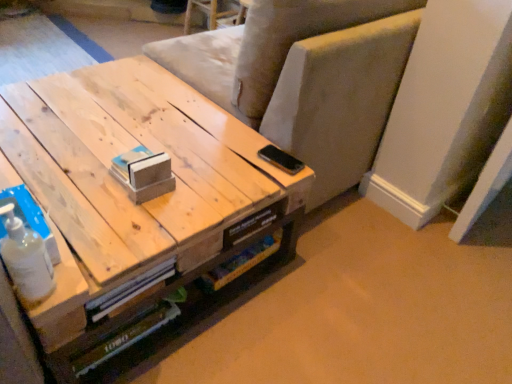
Where is `vacant space behind white matte bottle at lower left`? vacant space behind white matte bottle at lower left is located at coordinates (91, 218).